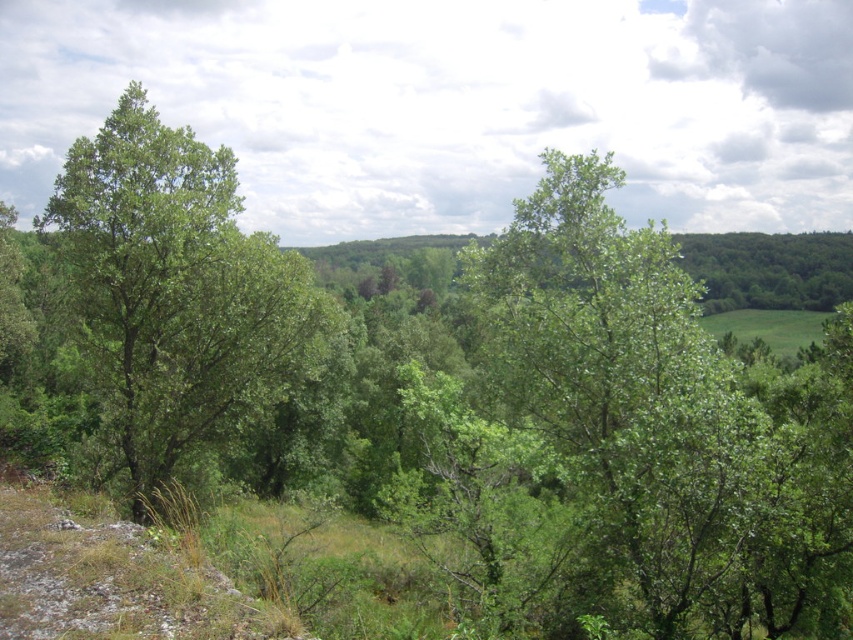
Which of these two, green leafy tree at center or green leafy tree at left, stands shorter?

With less height is green leafy tree at center.

Does point (703, 291) come farther from viewer compared to point (105, 352)?

That is False.

What do you see at coordinates (627, 440) in the screenshot? This screenshot has width=853, height=640. I see `green leafy tree at center` at bounding box center [627, 440].

The height and width of the screenshot is (640, 853). What are the coordinates of `green leafy tree at center` in the screenshot? It's located at (627, 440).